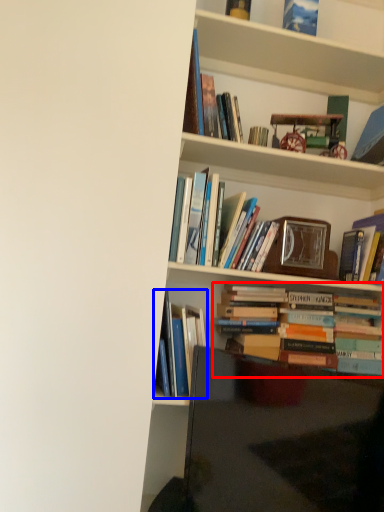
Question: Among these objects, which one is farthest to the camera, book (highlighted by a red box) or book (highlighted by a blue box)?

Choices:
 (A) book
 (B) book

Answer: (A)